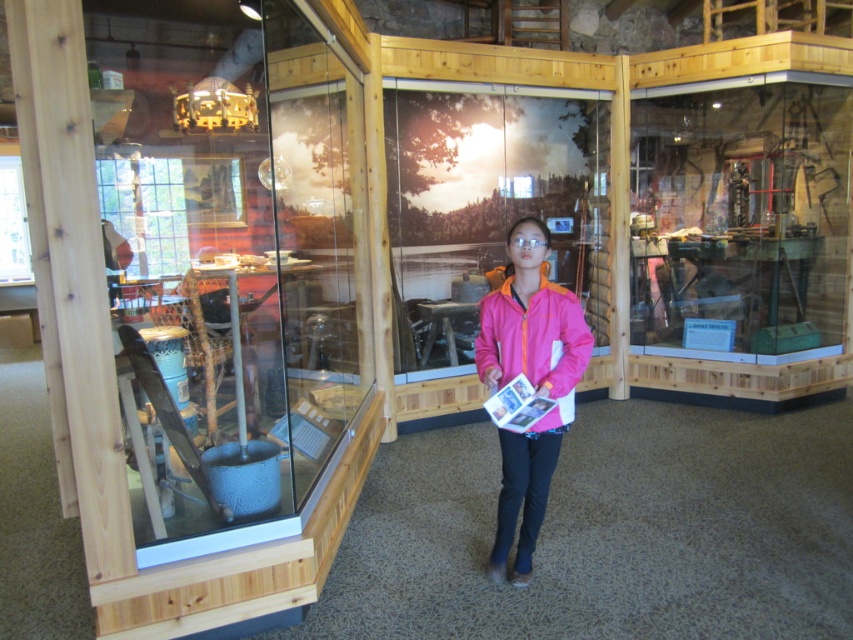
Question: Can you confirm if pink matte jacket at center is thinner than pink fleece jacket at center?

Choices:
 (A) no
 (B) yes

Answer: (B)

Question: Where is pink matte jacket at center located in relation to pink fleece jacket at center in the image?

Choices:
 (A) left
 (B) right

Answer: (A)

Question: Can you confirm if pink matte jacket at center is positioned to the left of pink fleece jacket at center?

Choices:
 (A) yes
 (B) no

Answer: (A)

Question: Which point is farther to the camera?

Choices:
 (A) (523, 458)
 (B) (509, 284)

Answer: (A)

Question: Which point is closer to the camera?

Choices:
 (A) (512, 282)
 (B) (534, 433)

Answer: (B)

Question: Which of the following is the closest to the observer?

Choices:
 (A) pink fleece jacket at center
 (B) pink matte jacket at center

Answer: (A)